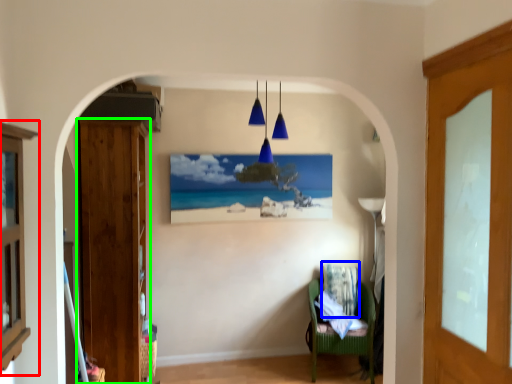
Question: Based on their relative distances, which object is nearer to cabinetry (highlighted by a red box)? Choose from pillow (highlighted by a blue box) and door (highlighted by a green box).

Choices:
 (A) pillow
 (B) door

Answer: (B)